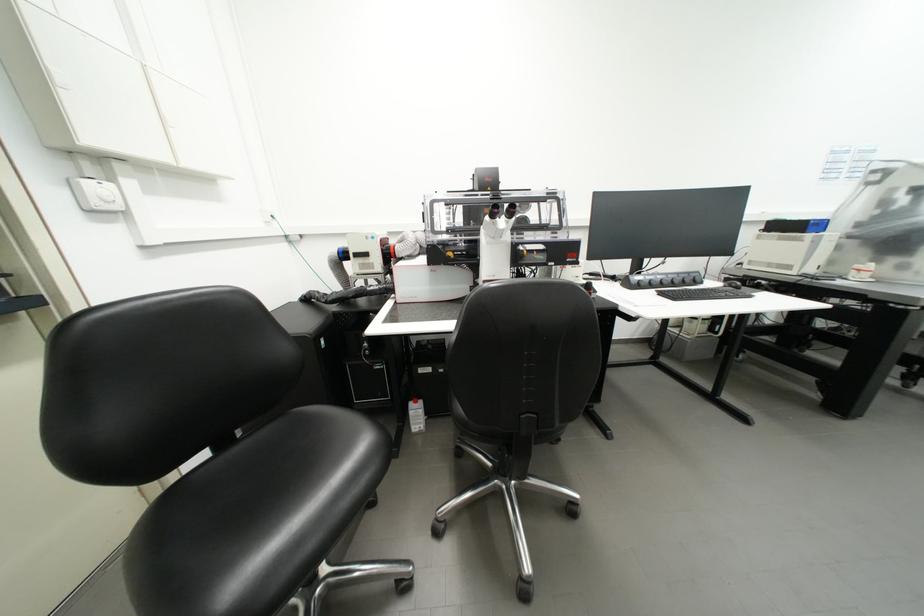
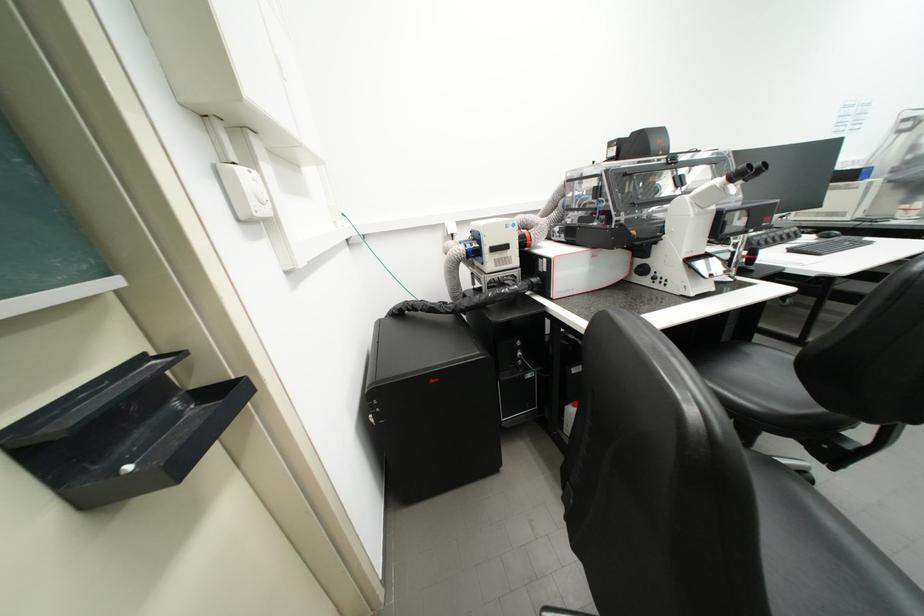
Question: Which direction would the cameraman need to move to produce the second image? Reply with the corresponding letter.

Choices:
 (A) Left
 (B) Right
 (C) Forward
 (D) Backward

Answer: (A)